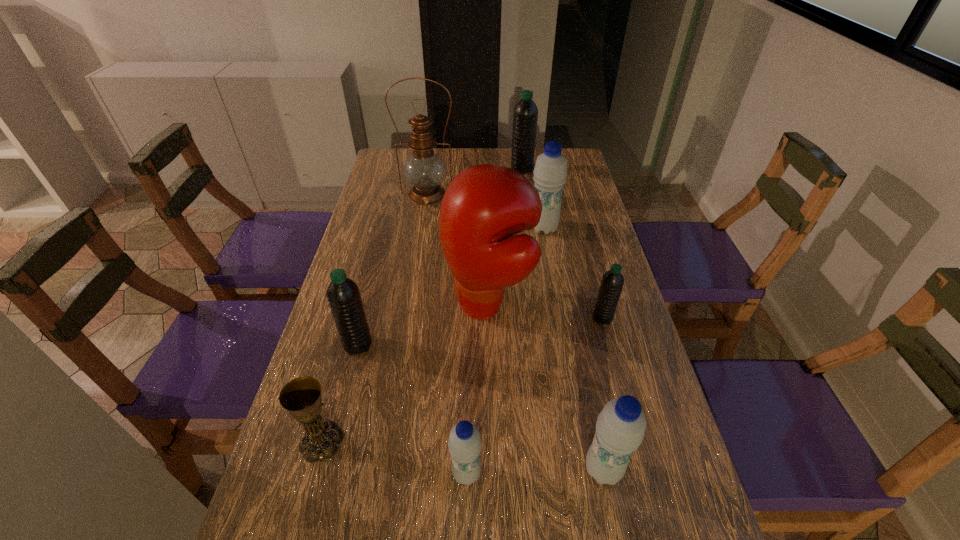
Where is `the rightmost black water bottle`? the rightmost black water bottle is located at coordinates (612, 282).

At what (x,y) coordinates should I click in order to perform the action: click on the fifth water bottle from right to left. Please return your answer as a coordinate pair (x, y). The image size is (960, 540). Looking at the image, I should click on (465, 443).

Where is `the smallest blue water bottle`? This screenshot has width=960, height=540. the smallest blue water bottle is located at coordinates (465, 443).

This screenshot has width=960, height=540. In order to click on chalice in this screenshot , I will do pyautogui.click(x=301, y=397).

Identify the location of free spot located 0.380m on the right of the second farthest object. The height and width of the screenshot is (540, 960). (561, 195).

The height and width of the screenshot is (540, 960). I want to click on vacant space located 0.080m on the striking surface of the boxing glove, so click(x=415, y=305).

Where is `free region located on the striking surface of the boxing glove`? free region located on the striking surface of the boxing glove is located at coordinates (341, 305).

Image resolution: width=960 pixels, height=540 pixels. I want to click on vacant space located 0.130m on the striking surface of the boxing glove, so pos(396,305).

Locate an element on the screen. The height and width of the screenshot is (540, 960). free space located 0.090m on the front of the farthest water bottle is located at coordinates (524, 187).

The height and width of the screenshot is (540, 960). What are the coordinates of `blank space located on the back of the second farthest water bottle` in the screenshot? It's located at (533, 167).